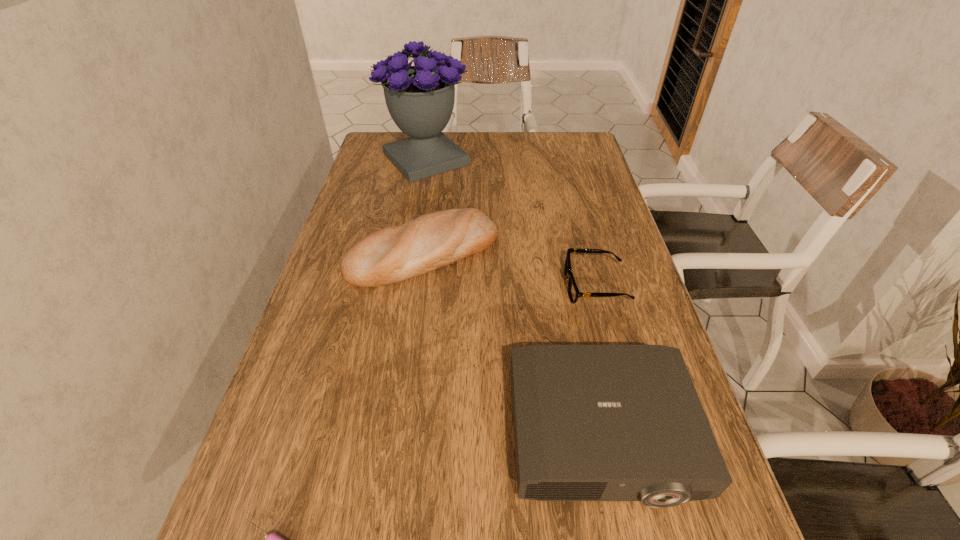
Image resolution: width=960 pixels, height=540 pixels. In order to click on object situated at the far edge in this screenshot , I will do (x=420, y=99).

This screenshot has width=960, height=540. I want to click on bouquet that is at the left edge, so click(x=420, y=99).

Find the location of `bread positioned at the left edge`. bread positioned at the left edge is located at coordinates (393, 254).

At what (x,y) coordinates should I click in order to perform the action: click on projector that is at the right edge. Please return your answer as a coordinate pair (x, y). The image size is (960, 540). Looking at the image, I should click on (591, 422).

Identify the location of sunglasses that is positioned at the right edge. (573, 291).

You are a GUI agent. You are given a task and a screenshot of the screen. Output one action in this format:
    pyautogui.click(x=<x>, y=<y>)
    Task: Click on the object situated at the far left corner
    The image size is (960, 540).
    Given the screenshot: What is the action you would take?
    pyautogui.click(x=420, y=99)

This screenshot has width=960, height=540. In order to click on vacant region at the far edge of the desktop in this screenshot , I will do `click(492, 158)`.

In the image, there is a desktop. Identify the location of vacant region at the left edge. The height and width of the screenshot is (540, 960). (342, 224).

Locate an element on the screen. The width and height of the screenshot is (960, 540). vacant region at the right edge is located at coordinates (614, 315).

In the image, there is a desktop. Identify the location of vacant space at the far right corner. (555, 141).